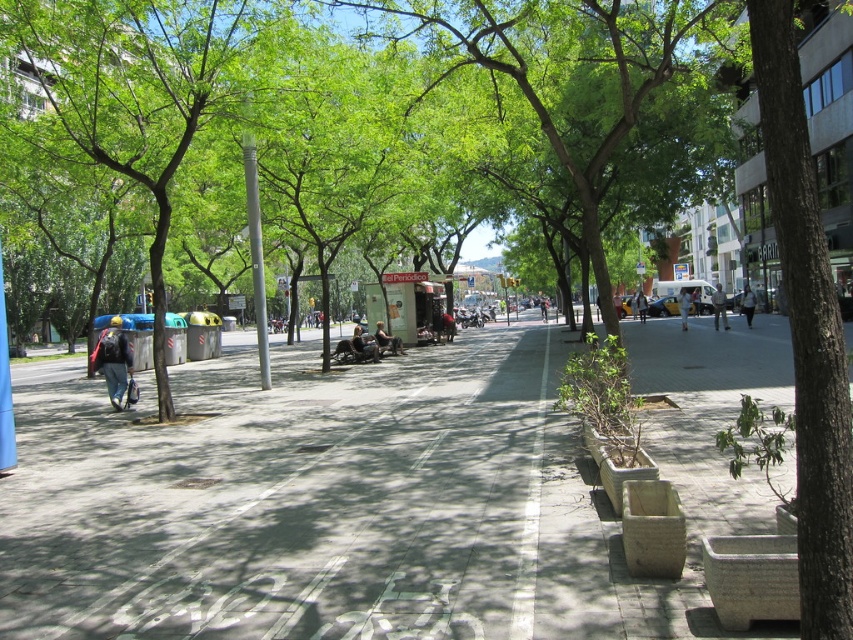
Is matte black backpack at left to the right of light brown leather jacket at center from the viewer's perspective?

No, matte black backpack at left is not to the right of light brown leather jacket at center.

Between matte black backpack at left and light brown leather jacket at center, which one appears on the right side from the viewer's perspective?

Positioned to the right is light brown leather jacket at center.

Find the location of a particular element. matte black backpack at left is located at coordinates (113, 360).

Between matte black backpack at left and white cotton shirt at center, which one appears on the right side from the viewer's perspective?

Positioned to the right is white cotton shirt at center.

Between point (123, 381) and point (744, 289), which one is positioned in front?

Positioned in front is point (123, 381).

Between point (120, 358) and point (741, 308), which one is positioned in front?

Positioned in front is point (120, 358).

What are the coordinates of `matte black backpack at left` in the screenshot? It's located at (113, 360).

Who is shorter, green leafy tree at right or matte black jacket at center?

matte black jacket at center is shorter.

Image resolution: width=853 pixels, height=640 pixels. I want to click on green leafy tree at right, so click(807, 330).